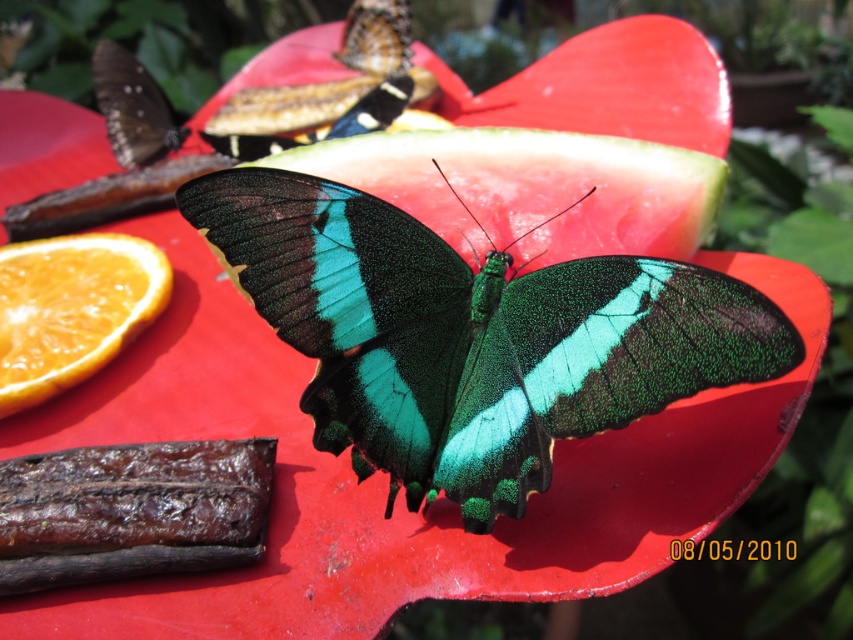
Question: Which object is the farthest from the orangejuicy/citrusyfruit at lower left?

Choices:
 (A) emerald-green iridescent butterfly at center
 (B) matte brown butterfly at upper left

Answer: (A)

Question: Is emerald-green iridescent butterfly at center smaller than orangejuicy/citrusyfruit at lower left?

Choices:
 (A) yes
 (B) no

Answer: (B)

Question: Does emerald-green iridescent butterfly at center have a larger size compared to orangejuicy/citrusyfruit at lower left?

Choices:
 (A) yes
 (B) no

Answer: (A)

Question: Which point appears farthest from the camera in this image?

Choices:
 (A) (164, 138)
 (B) (55, 282)
 (C) (682, 284)

Answer: (A)

Question: Where is orangejuicy/citrusyfruit at lower left located in relation to matte brown butterfly at upper left in the image?

Choices:
 (A) left
 (B) right

Answer: (A)

Question: Which is farther from the matte brown butterfly at upper left?

Choices:
 (A) orangejuicy/citrusyfruit at lower left
 (B) emerald-green iridescent butterfly at center

Answer: (B)